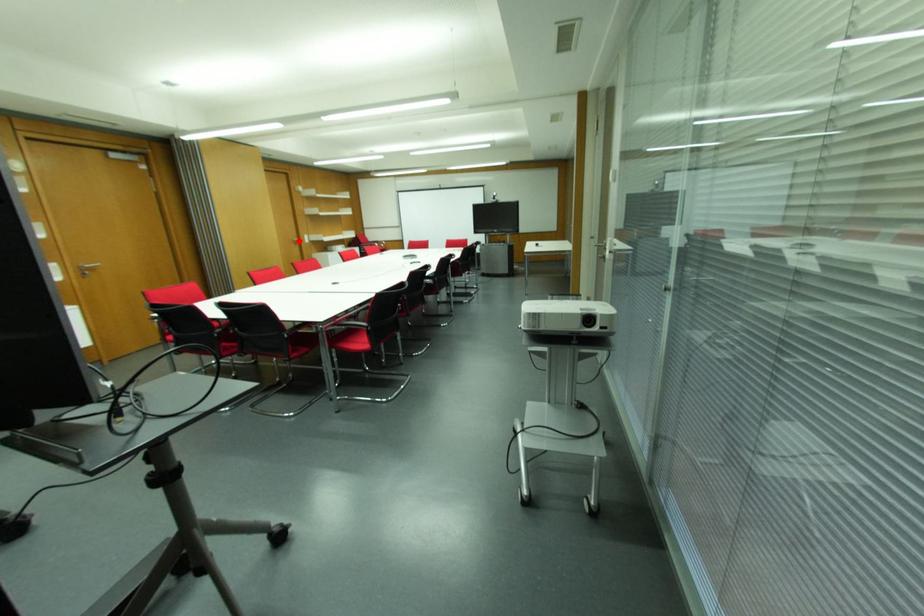
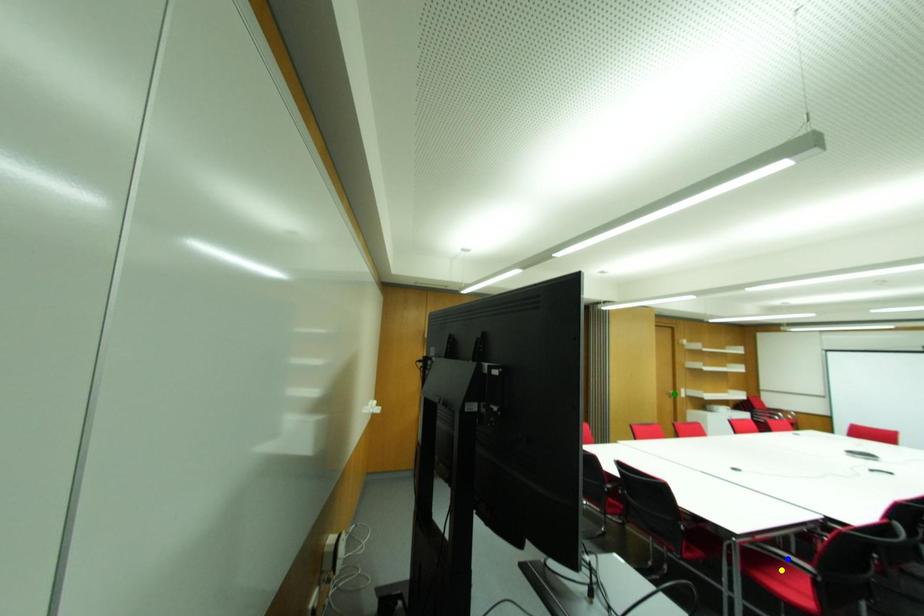
Question: I am providing you with two images of the same scene from different viewpoints. A red point is marked on the first image. You are given multiple points on the second image. Which spot in image 2 lines up with the point in image 1?

Choices:
 (A) green point
 (B) blue point
 (C) yellow point

Answer: (A)